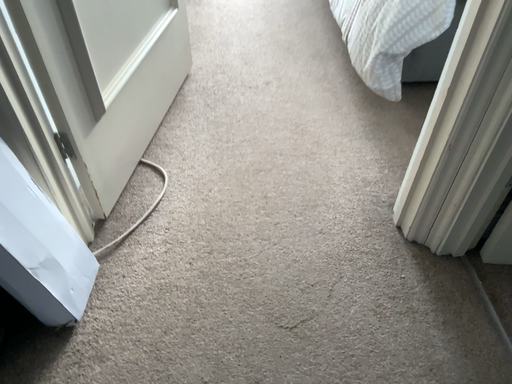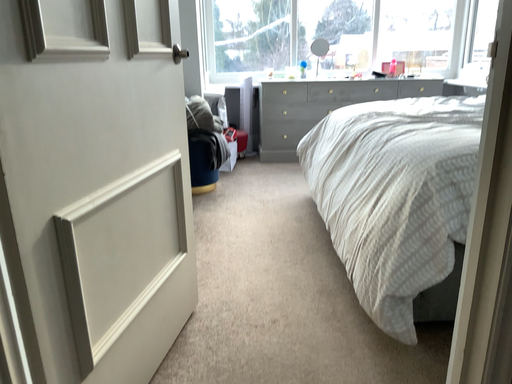
Question: Which way did the camera rotate in the video?

Choices:
 (A) rotated downward
 (B) rotated upward

Answer: (B)